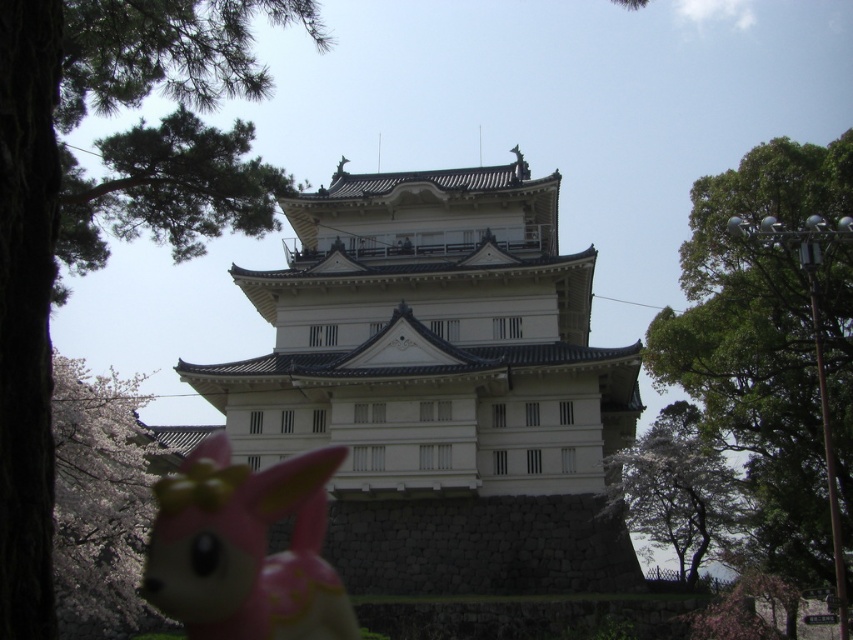
Is the position of green leafy tree at left less distant than that of white blossoms at lower left?

Yes, it is.

Consider the image. Which is more to the left, green leafy tree at left or white blossoms at lower left?

From the viewer's perspective, white blossoms at lower left appears more on the left side.

This screenshot has width=853, height=640. What do you see at coordinates (85, 204) in the screenshot?
I see `green leafy tree at left` at bounding box center [85, 204].

Where is `green leafy tree at left`? Image resolution: width=853 pixels, height=640 pixels. green leafy tree at left is located at coordinates (85, 204).

Is white stone tower at center smaller than green leafy tree at upper right?

Incorrect, white stone tower at center is not smaller in size than green leafy tree at upper right.

Can you confirm if white stone tower at center is thinner than green leafy tree at upper right?

No, white stone tower at center is not thinner than green leafy tree at upper right.

The image size is (853, 640). What do you see at coordinates (440, 384) in the screenshot?
I see `white stone tower at center` at bounding box center [440, 384].

You are a GUI agent. You are given a task and a screenshot of the screen. Output one action in this format:
    pyautogui.click(x=<x>, y=<y>)
    Task: Click on the white stone tower at center
    This screenshot has width=853, height=640.
    Given the screenshot: What is the action you would take?
    pyautogui.click(x=440, y=384)

Who is higher up, green textured pine branch at upper left or white textured tree at right?

green textured pine branch at upper left is above.

Locate an element on the screen. The image size is (853, 640). green textured pine branch at upper left is located at coordinates (164, 192).